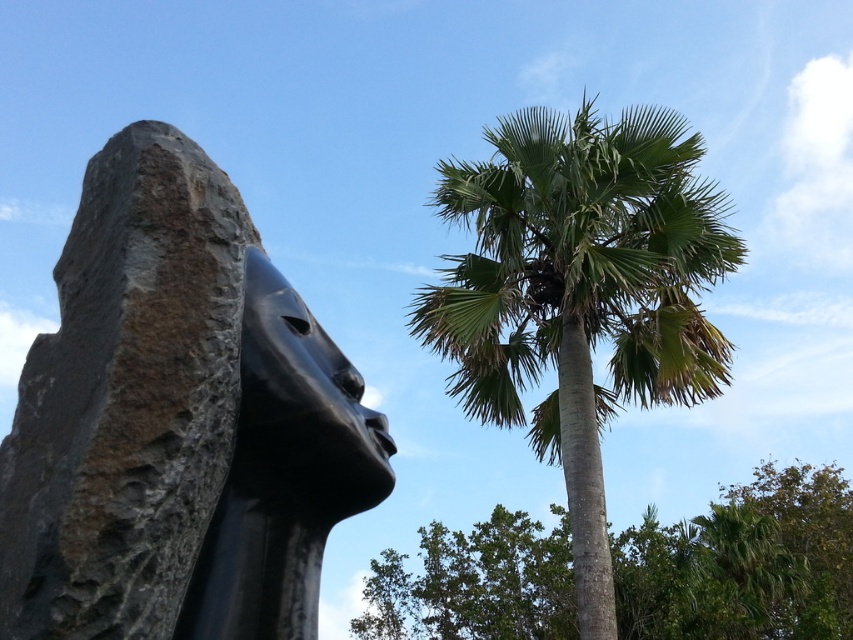
Question: Does green leafy palm at upper right lie in front of green leafy tree at center?

Choices:
 (A) yes
 (B) no

Answer: (A)

Question: Which point is closer to the camera?

Choices:
 (A) black polished stone sculpture at center
 (B) green leafy palm at upper right

Answer: (A)

Question: Based on their relative distances, which object is nearer to the green leafy tree at center?

Choices:
 (A) green leafy palm at upper right
 (B) black polished stone sculpture at center

Answer: (A)

Question: Can you confirm if green leafy tree at center is positioned below black glossy statue at center?

Choices:
 (A) yes
 (B) no

Answer: (A)

Question: Which point is farther from the camera taking this photo?

Choices:
 (A) (589, 285)
 (B) (207, 586)
 (C) (45, 612)

Answer: (A)

Question: Is green leafy palm at upper right positioned at the back of black glossy statue at center?

Choices:
 (A) yes
 (B) no

Answer: (A)